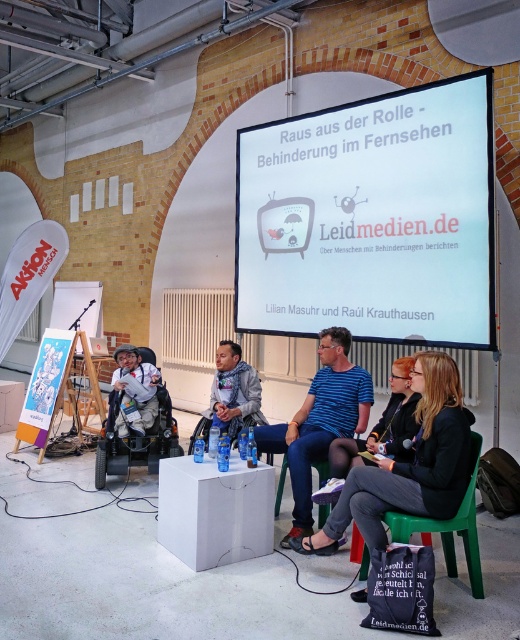
Does green plastic chair at lower right have a lesser height compared to light brown textured wheelchair at left?

In fact, green plastic chair at lower right may be taller than light brown textured wheelchair at left.

Does green plastic chair at lower right lie in front of light brown textured wheelchair at left?

Yes, green plastic chair at lower right is in front of light brown textured wheelchair at left.

The width and height of the screenshot is (520, 640). Describe the element at coordinates (450, 528) in the screenshot. I see `green plastic chair at lower right` at that location.

This screenshot has width=520, height=640. What are the coordinates of `green plastic chair at lower right` in the screenshot? It's located at (450, 528).

Is point (474, 545) in front of point (245, 424)?

Yes, point (474, 545) is closer to viewer.

Between green plastic chair at lower right and white plastic chair at center, which one has more height?

green plastic chair at lower right is taller.

Is point (475, 477) positioned in front of point (193, 435)?

That is True.

This screenshot has height=640, width=520. In order to click on green plastic chair at lower right in this screenshot , I will do `click(450, 528)`.

Does white glossy projection screen at upper center have a larger size compared to white plastic chair at center?

Yes.

At what (x,y) coordinates should I click in order to perform the action: click on white glossy projection screen at upper center. Please return your answer as a coordinate pair (x, y). This screenshot has width=520, height=640. Looking at the image, I should click on (371, 218).